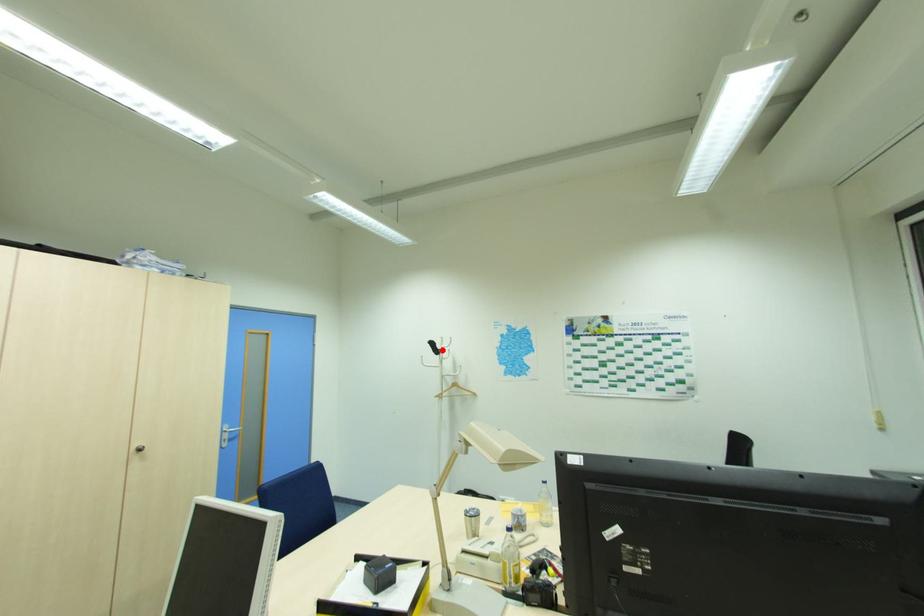
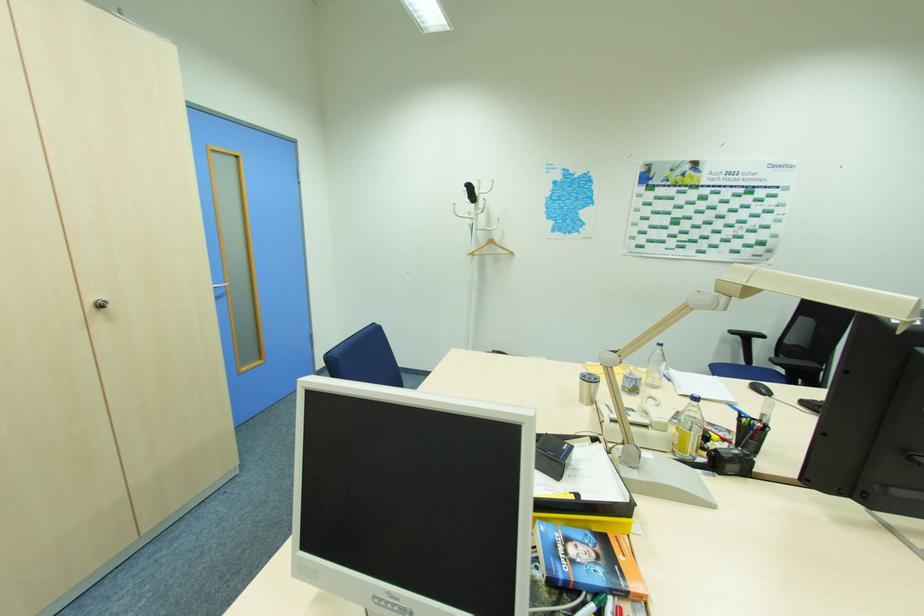
Question: I am providing you with two images of the same scene from different viewpoints. In image1, a red point is highlighted. Considering the same 3D point in image2, which of the following is correct?

Choices:
 (A) It is closer
 (B) It is farther

Answer: (A)